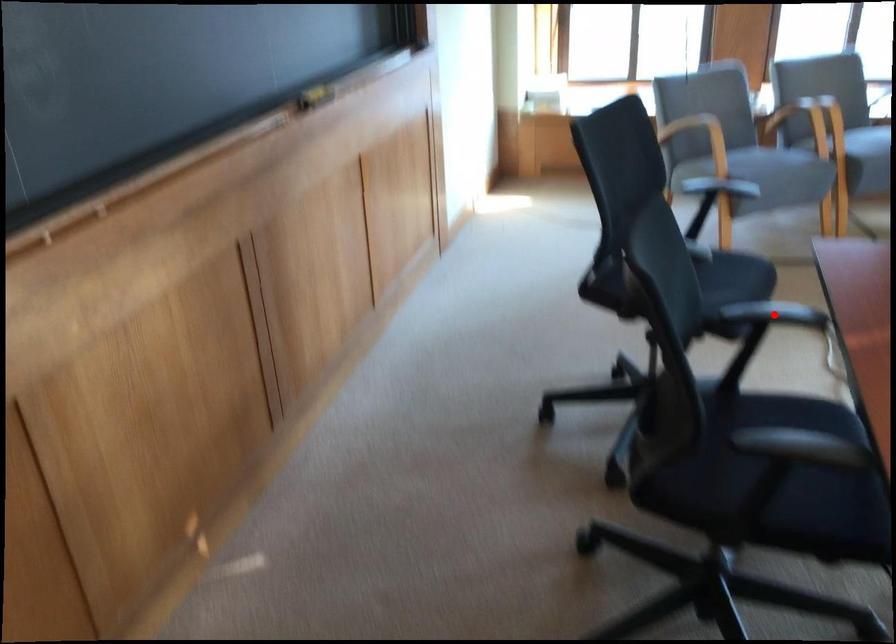
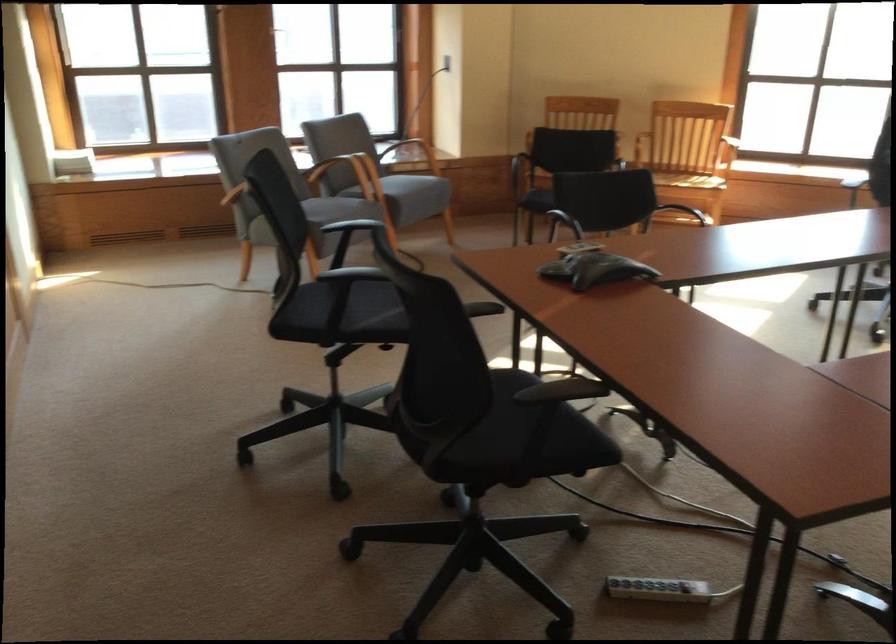
Question: I am providing you with two images of the same scene from different viewpoints. A red point is marked on the first image. Can you still see the location of the red point in image 2?

Choices:
 (A) Yes
 (B) No

Answer: (B)